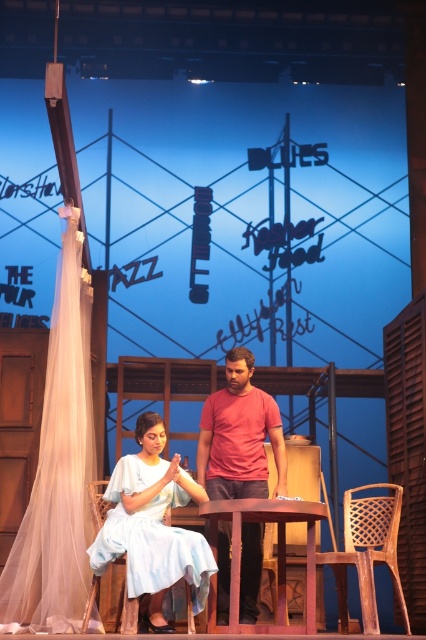
You are an actor on stage and need to quickly find the white cotton dress at center for your costume change. Based on the coordinates provided, can you determine if the dress is positioned closer to the left or right side of the stage?

The white cotton dress at center is located at point 0.822 on the x axis, which is closer to the right side of the stage since the coordinate system typically places 0 on the left and 1 on the right.